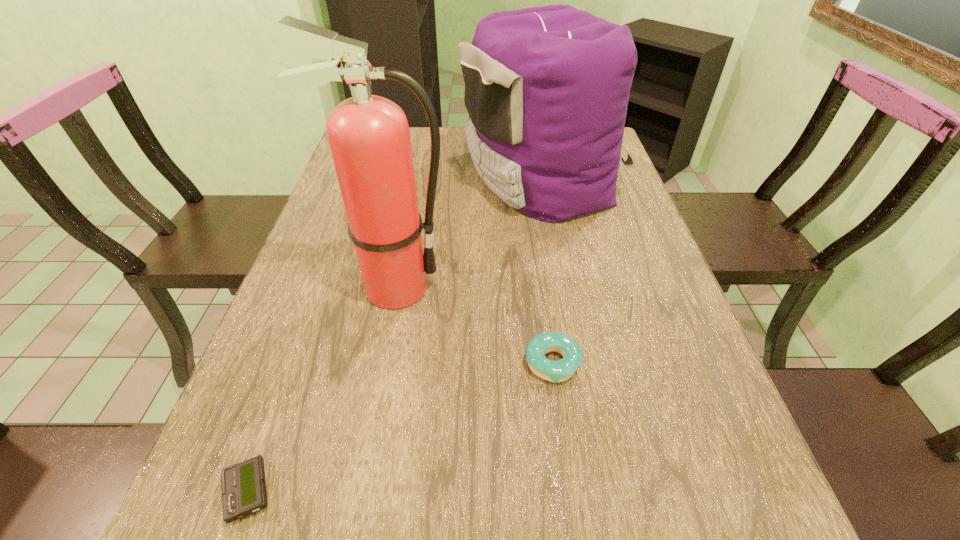
The width and height of the screenshot is (960, 540). Find the location of `unoccupied position between the farthest object and the shortest object`. unoccupied position between the farthest object and the shortest object is located at coordinates (395, 334).

Identify the location of vacant area that lies between the backpack and the doughnut. (547, 270).

Locate an element on the screen. vacant space in between the tallest object and the second tallest object is located at coordinates [x=468, y=232].

Image resolution: width=960 pixels, height=540 pixels. What are the coordinates of `vacant region between the third shortest object and the shortest object` in the screenshot? It's located at (395, 334).

At what (x,y) coordinates should I click in order to perform the action: click on vacant region between the nearest object and the doughnut. Please return your answer as a coordinate pair (x, y). The width and height of the screenshot is (960, 540). Looking at the image, I should click on (400, 427).

This screenshot has width=960, height=540. What are the coordinates of `vacant space in between the farthest object and the nearest object` in the screenshot? It's located at (395, 334).

Identify which object is located as the second nearest to the third farthest object. Please provide its 2D coordinates. Your answer should be formatted as a tuple, i.e. [(x, y)], where the tuple contains the x and y coordinates of a point satisfying the conditions above.

[(547, 88)]

Point out which object is positioned as the second nearest to the second farthest object. Please provide its 2D coordinates. Your answer should be formatted as a tuple, i.e. [(x, y)], where the tuple contains the x and y coordinates of a point satisfying the conditions above.

[(561, 370)]

You are a GUI agent. You are given a task and a screenshot of the screen. Output one action in this format:
    pyautogui.click(x=<x>, y=<y>)
    Task: Click on the blank space that satisfies the following two spatial constraints: 1. on the hose direction of the tallest object; 2. on the back side of the second nearest object
    The width and height of the screenshot is (960, 540).
    Given the screenshot: What is the action you would take?
    pyautogui.click(x=379, y=363)

What are the coordinates of `vacant point that satisfies the following two spatial constraints: 1. on the hose direction of the doughnut; 2. on the left side of the second farthest object` in the screenshot? It's located at (379, 363).